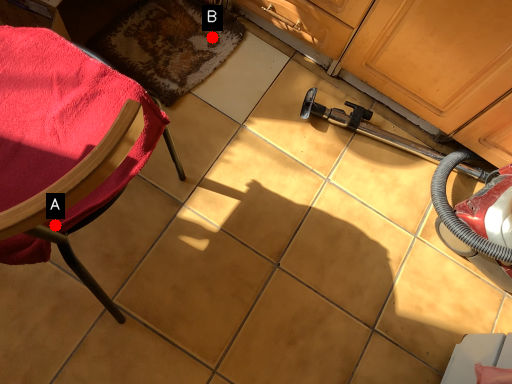
Question: Two points are circled on the image, labeled by A and B beside each circle. Which point appears farthest from the camera in this image?

Choices:
 (A) A is further
 (B) B is further

Answer: (B)